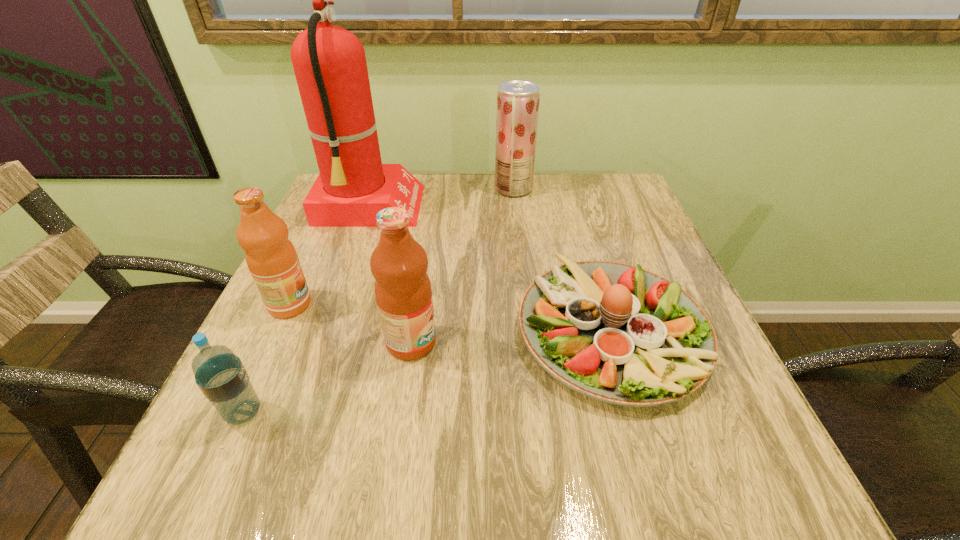
Where is `vacant space at the near edge`? The image size is (960, 540). vacant space at the near edge is located at coordinates (396, 452).

In the image, there is a desktop. At what (x,y) coordinates should I click in order to perform the action: click on vacant area at the left edge. Please return your answer as a coordinate pair (x, y). This screenshot has width=960, height=540. Looking at the image, I should click on pyautogui.click(x=318, y=353).

You are a GUI agent. You are given a task and a screenshot of the screen. Output one action in this format:
    pyautogui.click(x=<x>, y=<y>)
    Task: Click on the vacant space at the right edge
    Image resolution: width=960 pixels, height=540 pixels.
    Given the screenshot: What is the action you would take?
    pyautogui.click(x=587, y=227)

In the image, there is a desktop. Where is `blank space at the near left corner`? The image size is (960, 540). blank space at the near left corner is located at coordinates (218, 454).

In the image, there is a desktop. Where is `free region at the far right corner`? The height and width of the screenshot is (540, 960). free region at the far right corner is located at coordinates (610, 192).

In the image, there is a desktop. At what (x,y) coordinates should I click in order to perform the action: click on vacant region at the near right corner. Please return your answer as a coordinate pair (x, y). Looking at the image, I should click on click(701, 483).

Identify the location of empty location between the shortest object and the leftmost fruit juice. (450, 318).

Locate an element on the screen. This screenshot has height=540, width=960. free space that is in between the shortest object and the second fruit juice from right to left is located at coordinates (511, 336).

Where is `vacant area between the salad plate and the tallest object`? vacant area between the salad plate and the tallest object is located at coordinates (490, 269).

Locate an element on the screen. The image size is (960, 540). free space between the leftmost fruit juice and the salad plate is located at coordinates (450, 318).